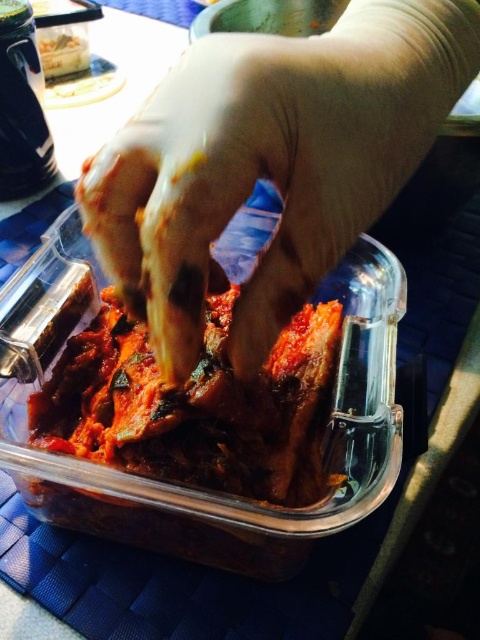
You are a food handler who needs to check the freshness of the dark red glossy kimchi at center. You have a gloved hand at center. What should you do next?

The gloved hand at center is positioned over dark red glossy kimchi at center, so you should use the gloved hand at center to gently press or scoop the dark red glossy kimchi at center to assess its texture and freshness.

You are a chef preparing a dish and need to ensure proper food handling. If your gloved hand at center is 5.26 inches away from the dark red glossy kimchi at center, can you safely touch the kimchi without moving your hand closer?

The gloved hand at center is 5.26 inches away from the dark red glossy kimchi at center, so you cannot safely touch the kimchi without moving your hand closer since there is a distance between them.

You are trying to grab the dark red glossy kimchi at center with your gloved hand at center. Considering their sizes, will you be able to fully grasp it?

The gloved hand at center has a larger size compared to dark red glossy kimchi at center, so yes, you can fully grasp it.